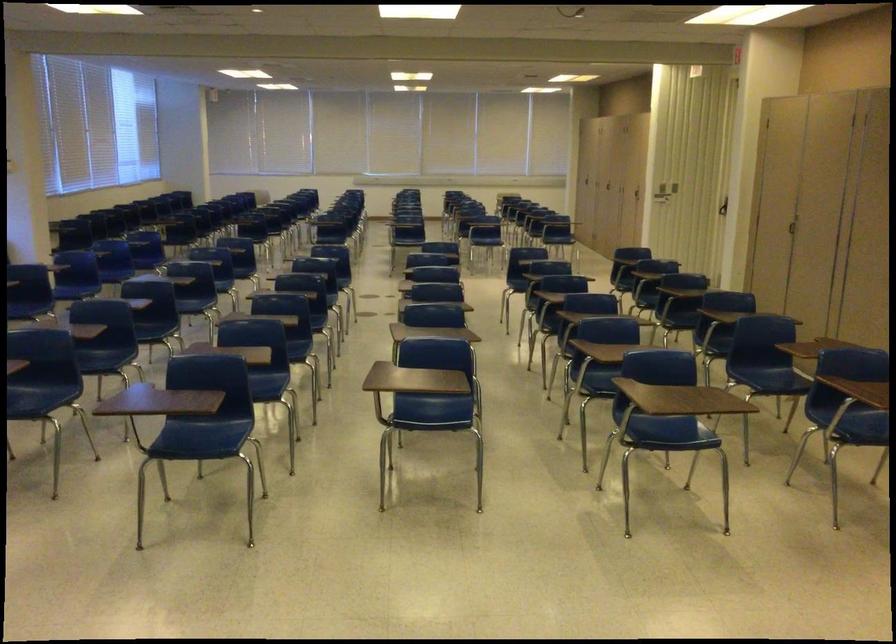
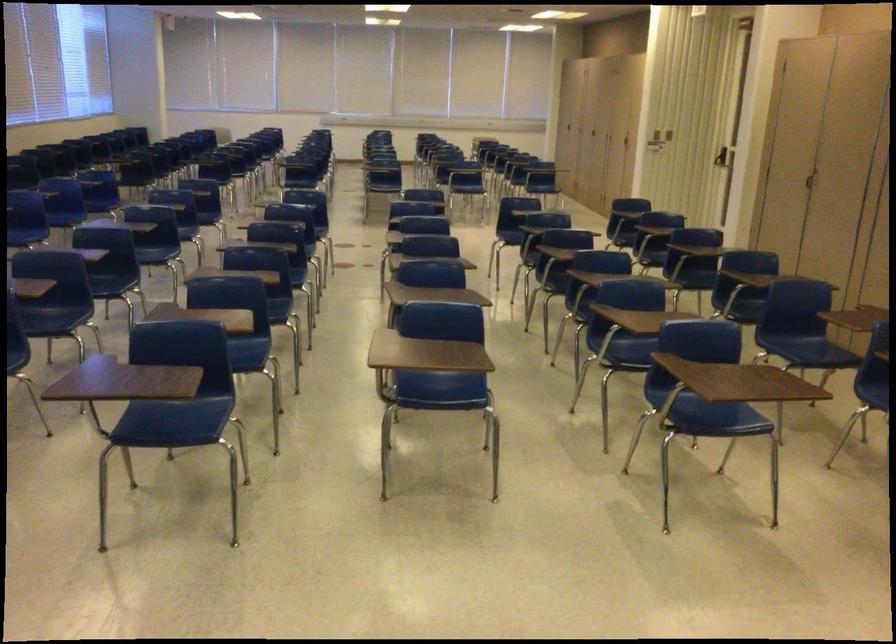
The point at (789, 223) is marked in the first image. Where is the corresponding point in the second image?

(808, 180)